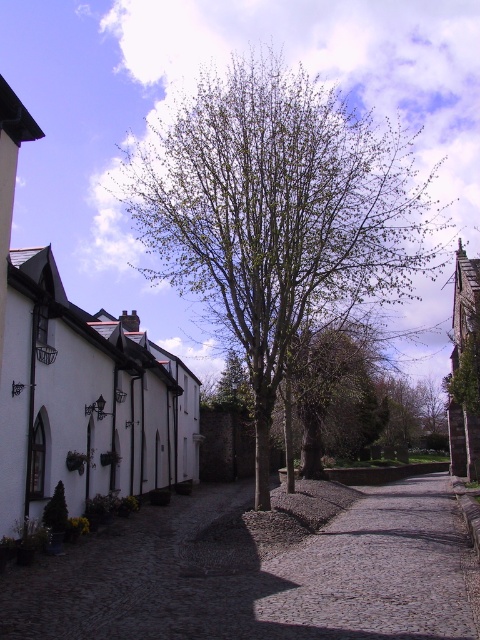
Question: Among these points, which one is nearest to the camera?

Choices:
 (A) (423, 266)
 (B) (120, 588)

Answer: (B)

Question: Which of the following is the closest to the observer?

Choices:
 (A) (244, 563)
 (B) (261, 636)

Answer: (B)

Question: Does green leafy tree at center have a smaller size compared to cobblestone path at center?

Choices:
 (A) no
 (B) yes

Answer: (A)

Question: Which point is closer to the camera?

Choices:
 (A) (408, 636)
 (B) (400, 602)

Answer: (A)

Question: Can you confirm if green leafy tree at center is positioned below cobblestone path at center?

Choices:
 (A) no
 (B) yes

Answer: (A)

Question: Can you confirm if green leafy tree at center is positioned below dark cobblestone path at center?

Choices:
 (A) no
 (B) yes

Answer: (A)